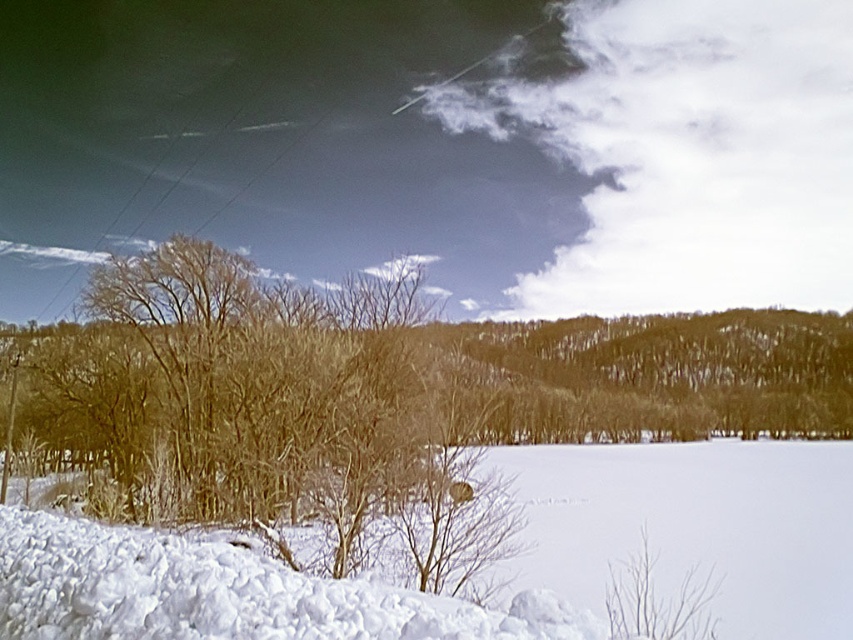
Question: Which point is closer to the camera?

Choices:
 (A) (160, 481)
 (B) (801, 595)

Answer: (B)

Question: Is the position of brown textured tree at left less distant than that of white fluffy snow at lower left?

Choices:
 (A) no
 (B) yes

Answer: (A)

Question: Is brown textured tree at left closer to the viewer compared to white fluffy snow at lower left?

Choices:
 (A) no
 (B) yes

Answer: (A)

Question: Which of the following is the farthest from the observer?

Choices:
 (A) white fluffy snow at lower left
 (B) brown textured tree at left

Answer: (B)

Question: Can you confirm if brown textured tree at left is bigger than white fluffy snow at lower left?

Choices:
 (A) no
 (B) yes

Answer: (B)